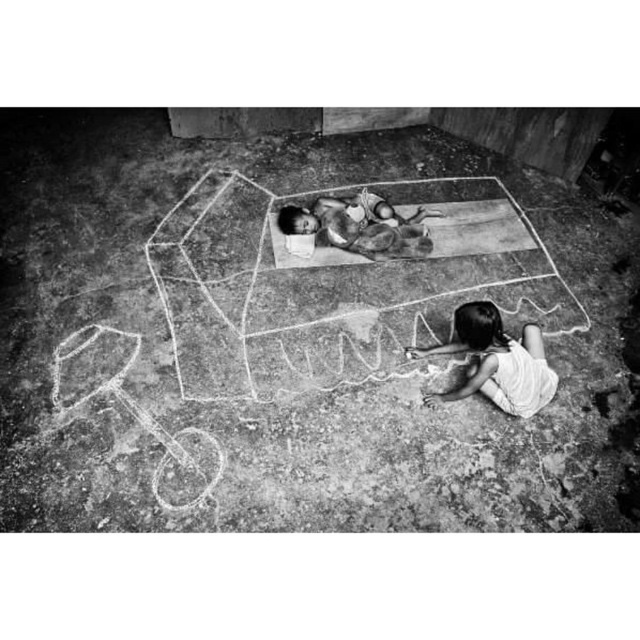
You are a photographer trying to capture a closeup shot of the chalk drawing of the truck. You have a camera with a 10cm wide lens. The smooth white shirt at lower right and the smooth skin child at center are blocking your view. Can you move the objects to get a clear shot? If so, which one should you move and why?

The smooth white shirt at lower right has a larger size compared to smooth skin child at center. You should move the smooth white shirt at lower right because it is larger and might be covering more of the chalk drawing, making it easier to move out of the way to get a clear shot.